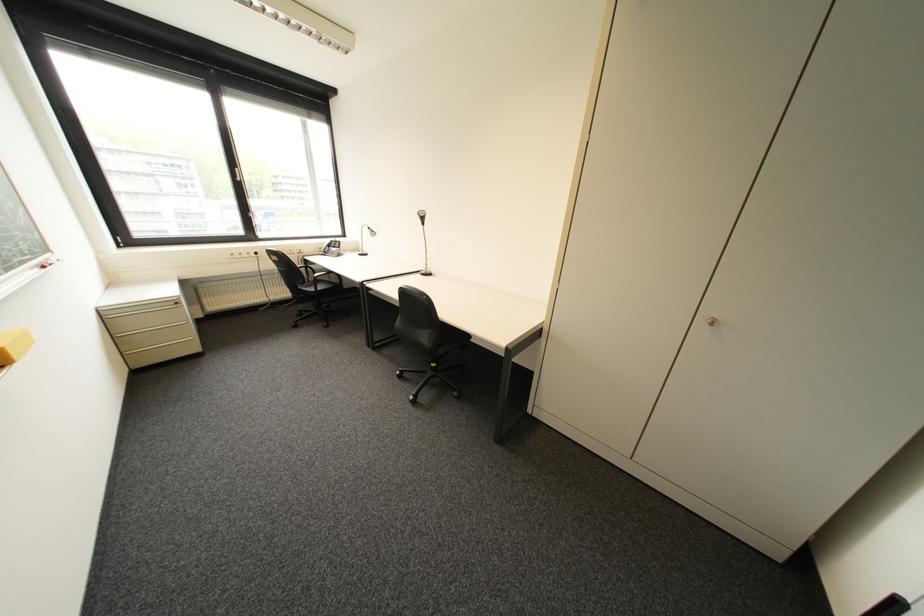
Where would you resting arm the black chair armrest? Please return your answer as a coordinate pair (x, y).

(322, 273)